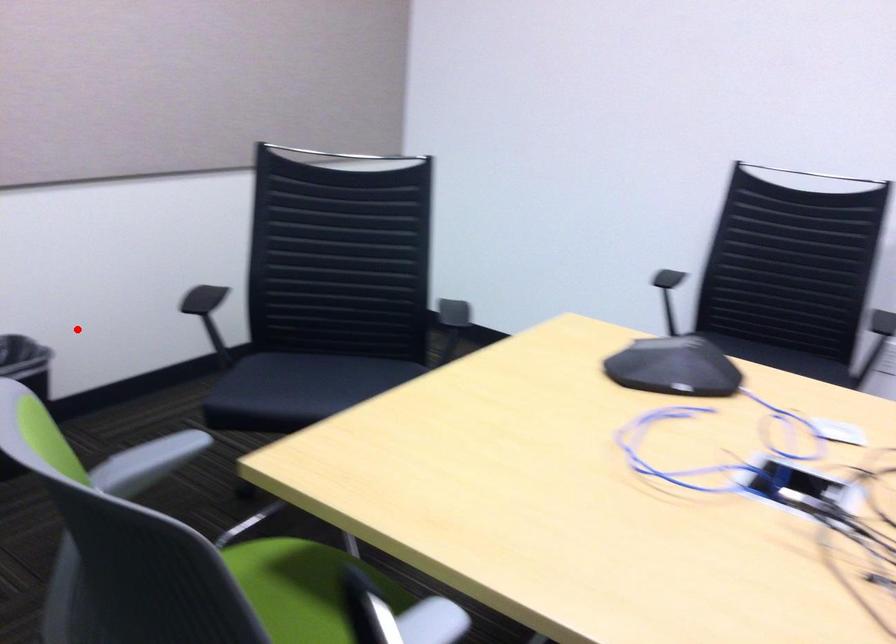
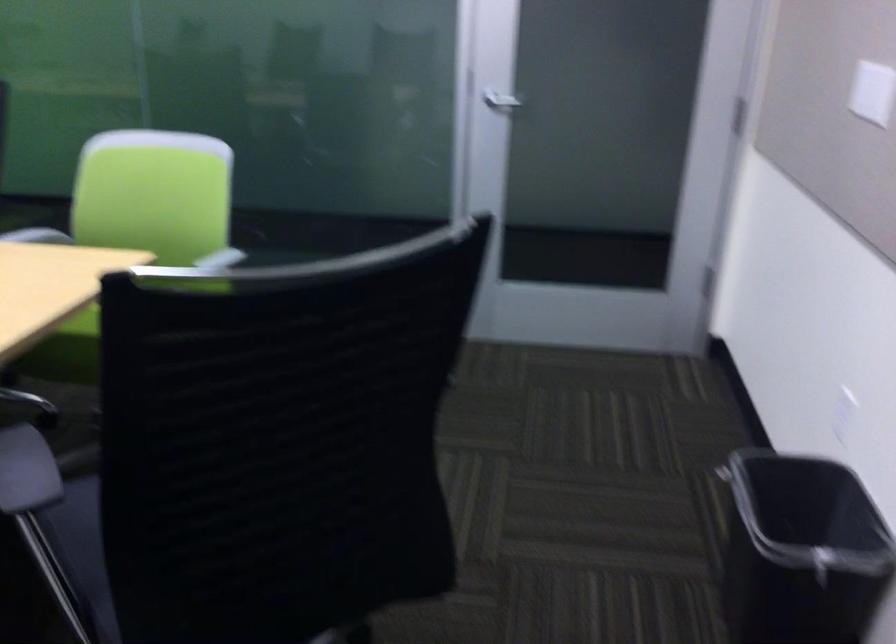
Question: I am providing you with two images of the same scene from different viewpoints. Given a red point in image1, look at the same physical point in image2. Is it:

Choices:
 (A) Closer to the viewpoint
 (B) Farther from the viewpoint

Answer: (A)